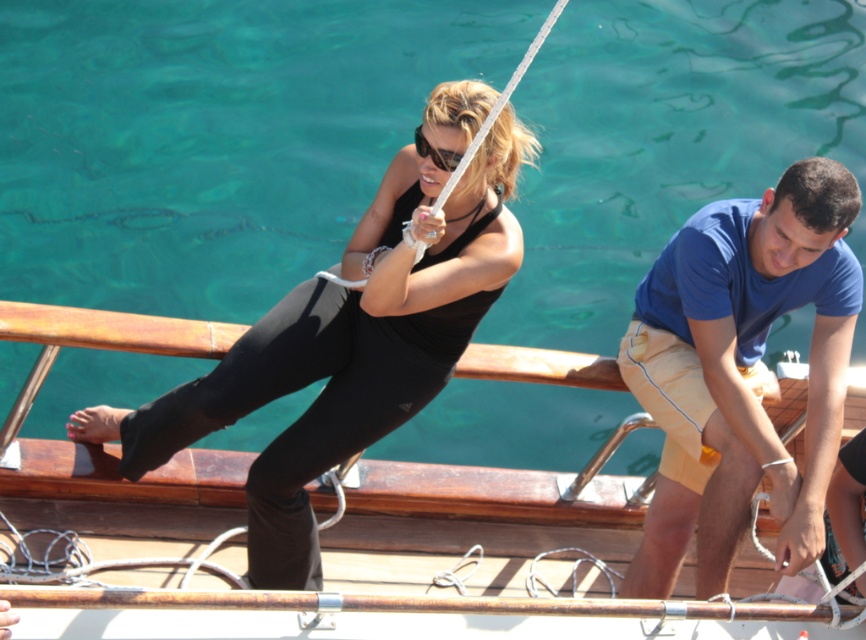
Question: Does black matte tank top at center appear on the left side of black plastic goggles at center?

Choices:
 (A) no
 (B) yes

Answer: (B)

Question: Which of the following is the farthest from the observer?

Choices:
 (A) wooden deck at center
 (B) black matte tank top at center

Answer: (A)

Question: Can you confirm if clear blue water at center is wider than wooden deck at center?

Choices:
 (A) no
 (B) yes

Answer: (B)

Question: Which object is farther from the camera taking this photo?

Choices:
 (A) black matte tank top at center
 (B) wooden deck at center

Answer: (B)

Question: Among these points, which one is nearest to the camera?

Choices:
 (A) (414, 340)
 (B) (130, 292)
 (C) (415, 140)
 (D) (705, 205)

Answer: (C)

Question: Does clear blue water at center appear over blue cotton t-shirt at right?

Choices:
 (A) no
 (B) yes

Answer: (B)